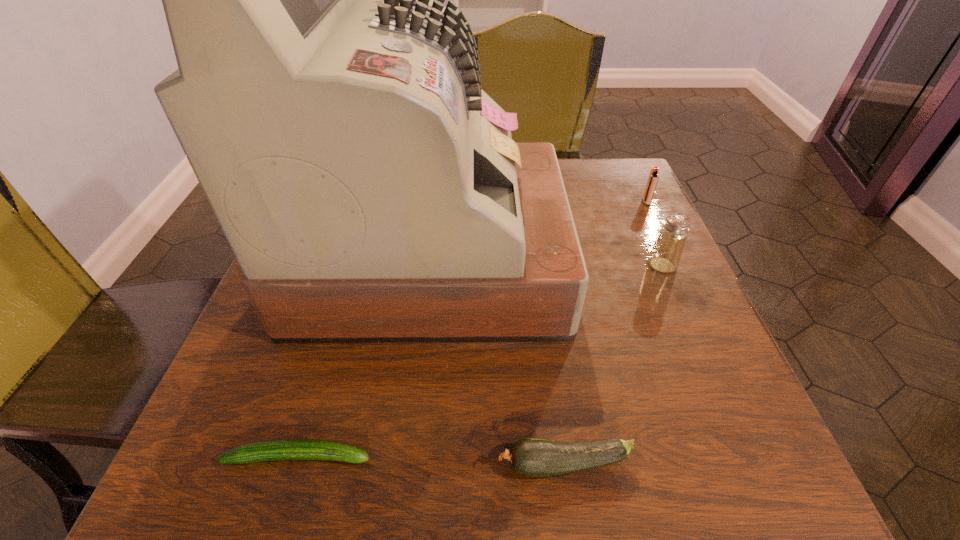
The image size is (960, 540). What are the coordinates of `object present at the far left corner` in the screenshot? It's located at (330, 105).

Where is `object positioned at the near left corner`? Image resolution: width=960 pixels, height=540 pixels. object positioned at the near left corner is located at coordinates (286, 449).

Find the location of a particular element. object at the far right corner is located at coordinates (653, 177).

The height and width of the screenshot is (540, 960). Find the location of `vacant space at the right edge`. vacant space at the right edge is located at coordinates (608, 299).

At what (x,y) coordinates should I click in order to perform the action: click on free space at the near right corner of the desktop. Please return your answer as a coordinate pair (x, y). The height and width of the screenshot is (540, 960). Looking at the image, I should click on click(x=686, y=449).

You are a GUI agent. You are given a task and a screenshot of the screen. Output one action in this format:
    pyautogui.click(x=<x>, y=<y>)
    Task: Click on the free space between the saltshaker and the second shortest object
    The width and height of the screenshot is (960, 540).
    Given the screenshot: What is the action you would take?
    pyautogui.click(x=613, y=364)

The image size is (960, 540). What are the coordinates of `empty space that is in between the fourth tallest object and the saltshaker` in the screenshot? It's located at (613, 364).

Find the location of a particular element. The width and height of the screenshot is (960, 540). unoccupied area between the fourth shortest object and the second shortest object is located at coordinates (613, 364).

At what (x,y) coordinates should I click in order to perform the action: click on vacant area between the saltshaker and the third tallest object. Please return your answer as a coordinate pair (x, y). The width and height of the screenshot is (960, 540). Looking at the image, I should click on (654, 233).

You are a GUI agent. You are given a task and a screenshot of the screen. Output one action in this format:
    pyautogui.click(x=<x>, y=<y>)
    Task: Click on the vacant point located between the shortest object and the taller zucchini
    This screenshot has height=540, width=960.
    Given the screenshot: What is the action you would take?
    pyautogui.click(x=432, y=460)